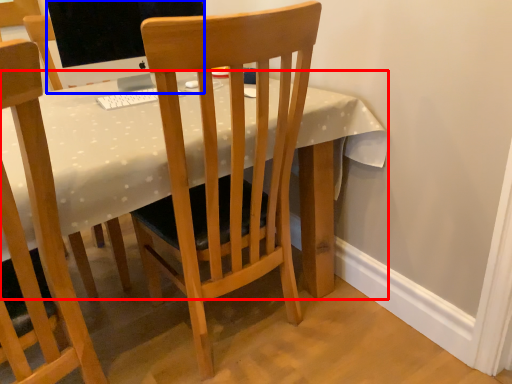
Question: Which of the following is the closest to the observer, desk (highlighted by a red box) or television (highlighted by a blue box)?

Choices:
 (A) desk
 (B) television

Answer: (A)